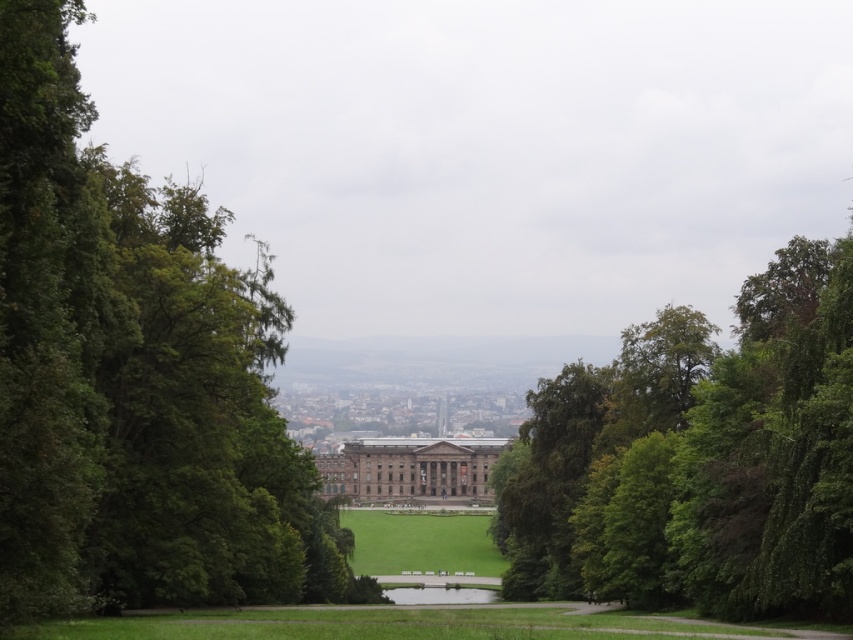
You are standing at the entrance of the brown stone palace at center and want to walk towards the green leafy tree at center. Which direction should you face to walk directly towards it?

You should face to the right to walk directly towards the green leafy tree at center since it is located to the right of the brown stone palace at center.

You are standing in the grassy area and want to walk towards the large building in the middle ground. Which green leafy tree do you pass first, the green leafy tree at left or the green leafy tree at center?

The green leafy tree at left is closer to the viewer than the green leafy tree at center, so you will pass the green leafy tree at left first on your way to the large building in the middle ground.

You are a landscape architect designing a walking path that needs to pass between the green leafy tree at left and the brown stone palace at center. Based on their positions, which direction should the path curve to avoid the tree and palace?

The green leafy tree at left is located above the brown stone palace at center, so the path should curve downward from the tree towards the palace to avoid both structures.